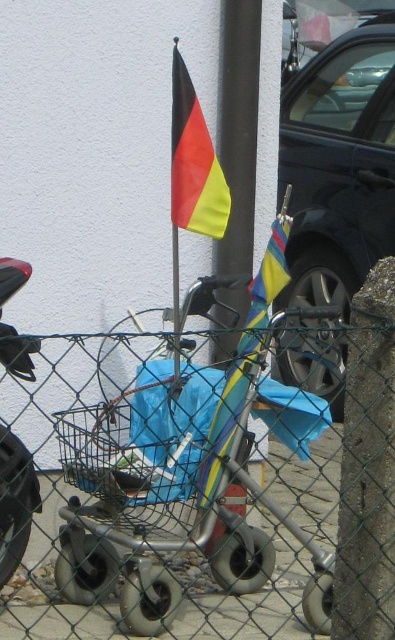
What do you see at coordinates (248, 595) in the screenshot? The width and height of the screenshot is (395, 640). I see `smooth concrete pavement at lower center` at bounding box center [248, 595].

Measure the distance from smooth concrete pavement at lower center to polyester flag at center.

smooth concrete pavement at lower center and polyester flag at center are 18.16 inches apart.

The width and height of the screenshot is (395, 640). What are the coordinates of `smooth concrete pavement at lower center` in the screenshot? It's located at (248, 595).

Can you confirm if shiny black car at right is positioned above polyester flag at center?

Yes.

Between point (325, 147) and point (227, 445), which one is positioned in front?

Point (227, 445)

The image size is (395, 640). Find the location of `shiny black car at right`. shiny black car at right is located at coordinates (338, 164).

Who is positioned more to the left, shiny black motorcycle at left or polyester flag at center?

shiny black motorcycle at left is more to the left.

In the scene shown: Which is below, shiny black motorcycle at left or polyester flag at center?

shiny black motorcycle at left is below.

Find the location of `shiny black motorcycle at left`. shiny black motorcycle at left is located at coordinates (15, 500).